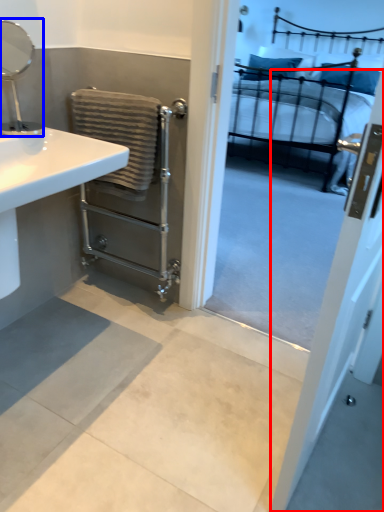
Question: Which point is closer to the camera, screen door (highlighted by a red box) or mirror (highlighted by a blue box)?

Choices:
 (A) screen door
 (B) mirror

Answer: (A)